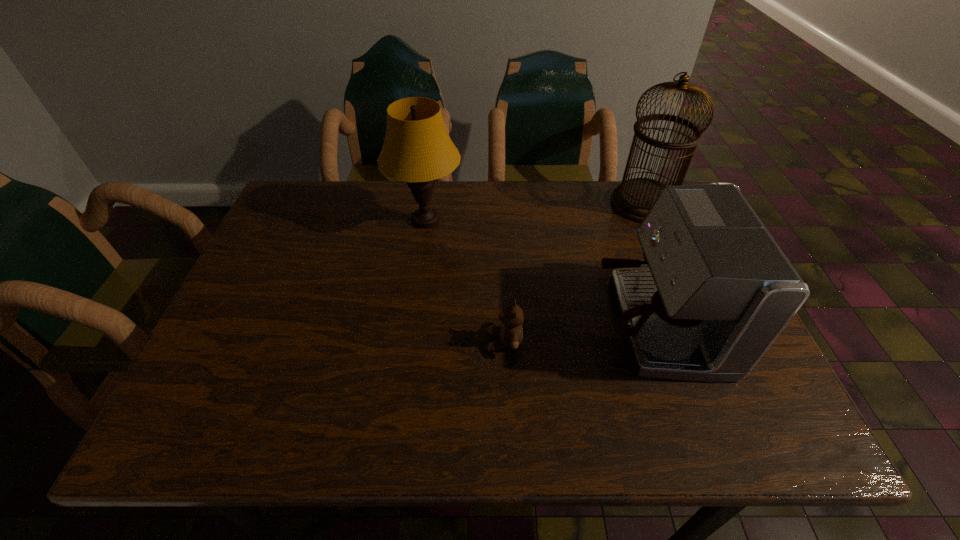
Find the location of a particular element. free space at the far edge is located at coordinates (568, 186).

At what (x,y) coordinates should I click in order to perform the action: click on vacant space at the near edge of the desktop. Please return your answer as a coordinate pair (x, y). The image size is (960, 540). Looking at the image, I should click on (646, 419).

Locate an element on the screen. The image size is (960, 540). free space at the left edge of the desktop is located at coordinates (184, 395).

Locate an element on the screen. Image resolution: width=960 pixels, height=540 pixels. free spot at the far left corner of the desktop is located at coordinates (284, 221).

The image size is (960, 540). I want to click on vacant space at the near left corner of the desktop, so click(222, 419).

The height and width of the screenshot is (540, 960). What are the coordinates of `unoccupied position between the birdcage and the shortest object` in the screenshot? It's located at (574, 273).

You are a GUI agent. You are given a task and a screenshot of the screen. Output one action in this format:
    pyautogui.click(x=<x>, y=<y>)
    Task: Click on the free space between the lampshade and the coffee maker
    The height and width of the screenshot is (540, 960).
    Given the screenshot: What is the action you would take?
    pyautogui.click(x=540, y=272)

Locate an element on the screen. The height and width of the screenshot is (540, 960). unoccupied position between the second object from left to right and the coffee maker is located at coordinates tap(580, 332).

Identify the location of empty space that is in between the third tallest object and the lampshade. (540, 272).

You are a GUI agent. You are given a task and a screenshot of the screen. Output one action in this format:
    pyautogui.click(x=<x>, y=<y>)
    Task: Click on the free spot between the teddy bear and the birdcage
    
    Given the screenshot: What is the action you would take?
    tap(574, 273)